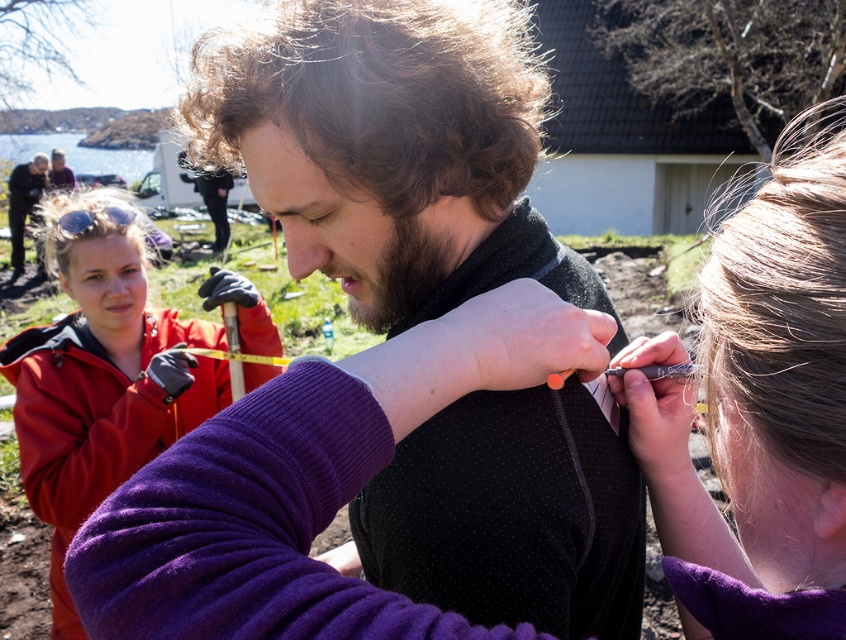
Question: Which object is the farthest from the purple fabric hair at upper right?

Choices:
 (A) red jacket at left
 (B) matte black jacket at upper left

Answer: (B)

Question: Does black textured sweater at center appear on the right side of yellow rubber tape at center?

Choices:
 (A) no
 (B) yes

Answer: (B)

Question: Does red jacket at left have a lesser width compared to brown matte ponytail at center?

Choices:
 (A) yes
 (B) no

Answer: (B)

Question: Considering the real-world distances, which object is closest to the dark gray jacket at upper left?

Choices:
 (A) red jacket at left
 (B) black textured sweater at center
 (C) yellow rubber tape at center

Answer: (A)

Question: Which object appears farthest from the camera in this image?

Choices:
 (A) matte black jacket at upper left
 (B) red jacket at left

Answer: (A)

Question: Is purple fabric hair at upper right positioned at the back of dark gray jacket at upper left?

Choices:
 (A) no
 (B) yes

Answer: (A)